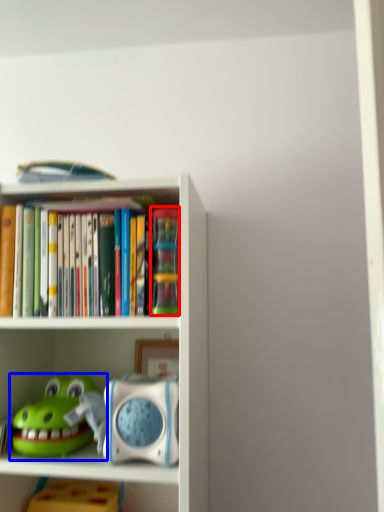
Question: Which object is closer to the camera taking this photo, toy (highlighted by a red box) or toy (highlighted by a blue box)?

Choices:
 (A) toy
 (B) toy

Answer: (B)